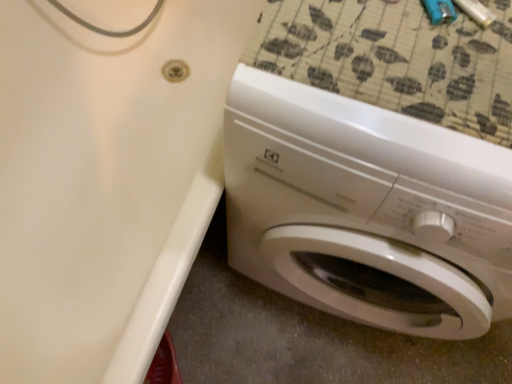
Question: Is white glossy bathtub at lower right wider or thinner than white glossy washing machine at lower right?

Choices:
 (A) thin
 (B) wide

Answer: (B)

Question: From the image's perspective, is white glossy bathtub at lower right above or below white glossy washing machine at lower right?

Choices:
 (A) above
 (B) below

Answer: (A)

Question: Based on their sizes in the image, would you say white glossy bathtub at lower right is bigger or smaller than white glossy washing machine at lower right?

Choices:
 (A) big
 (B) small

Answer: (A)

Question: From a real-world perspective, is white glossy washing machine at lower right positioned above or below white glossy bathtub at lower right?

Choices:
 (A) below
 (B) above

Answer: (B)

Question: From their relative heights in the image, would you say white glossy washing machine at lower right is taller or shorter than white glossy bathtub at lower right?

Choices:
 (A) short
 (B) tall

Answer: (B)

Question: In the image, is white glossy washing machine at lower right positioned in front of or behind white glossy bathtub at lower right?

Choices:
 (A) front
 (B) behind

Answer: (A)

Question: Based on their positions, is white glossy washing machine at lower right located to the left or right of white glossy bathtub at lower right?

Choices:
 (A) left
 (B) right

Answer: (B)